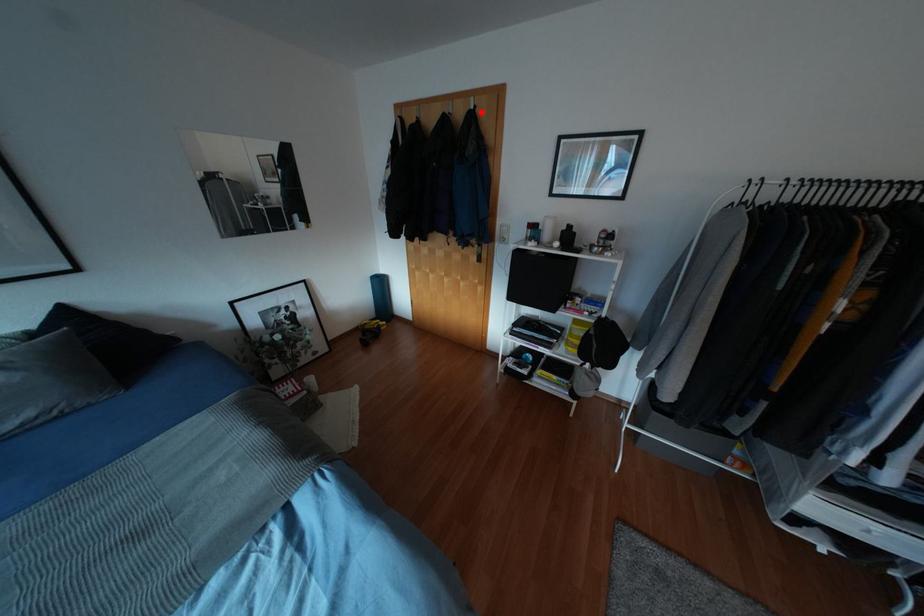
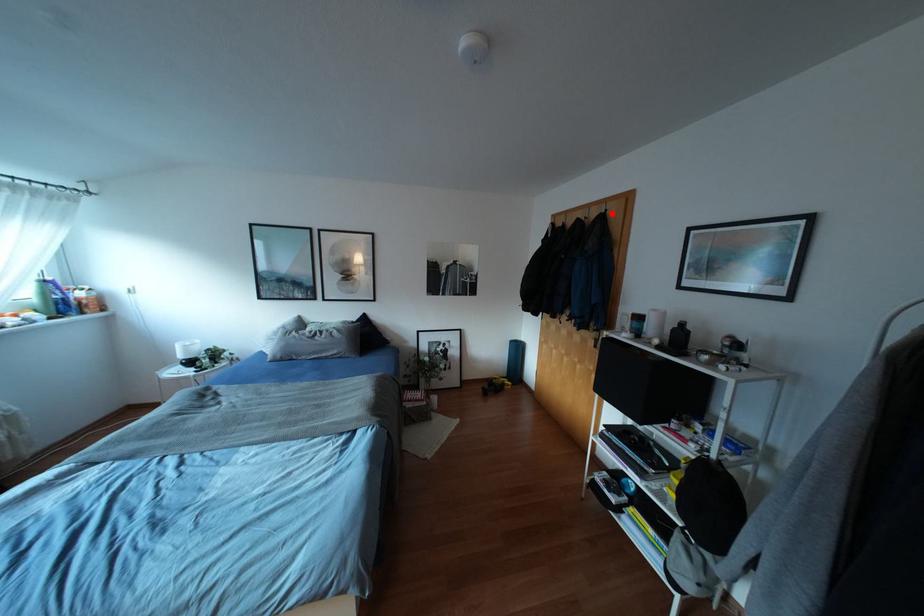
I am providing you with two images of the same scene from different viewpoints. A red point is marked on the first image and another point is marked on the second image. Is the red point in image1 aligned with the point shown in image2?

Yes